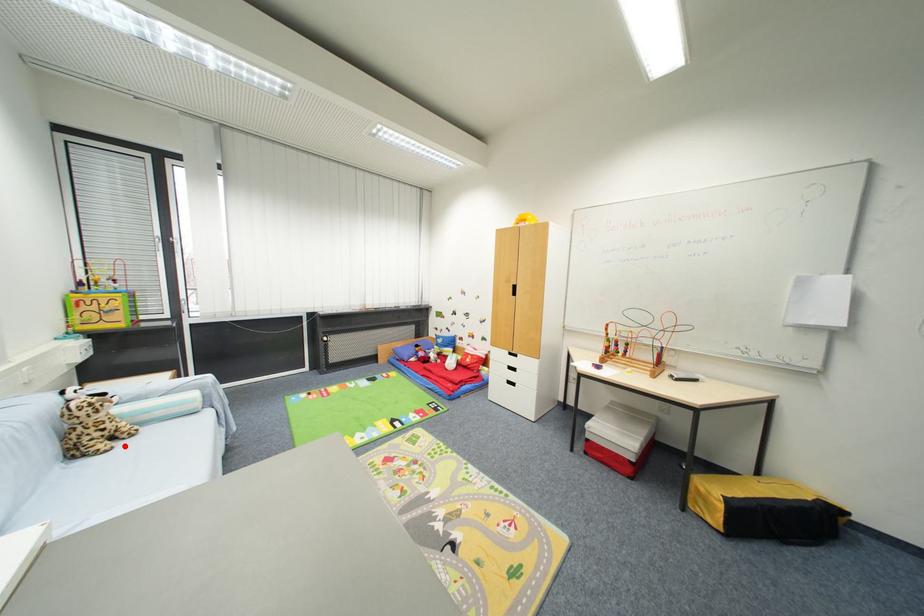
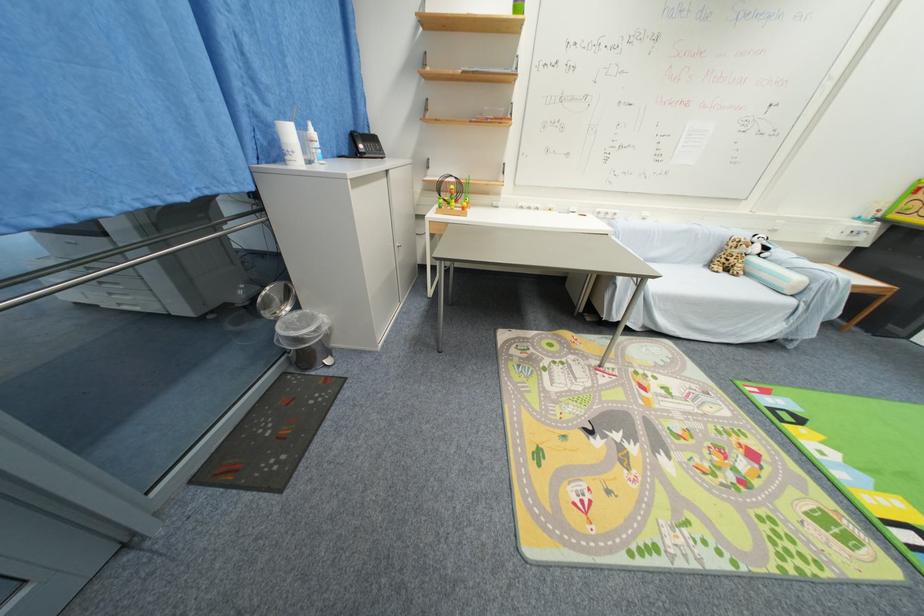
In the second image, find the point that corresponds to the highlighted location in the first image.

(730, 276)